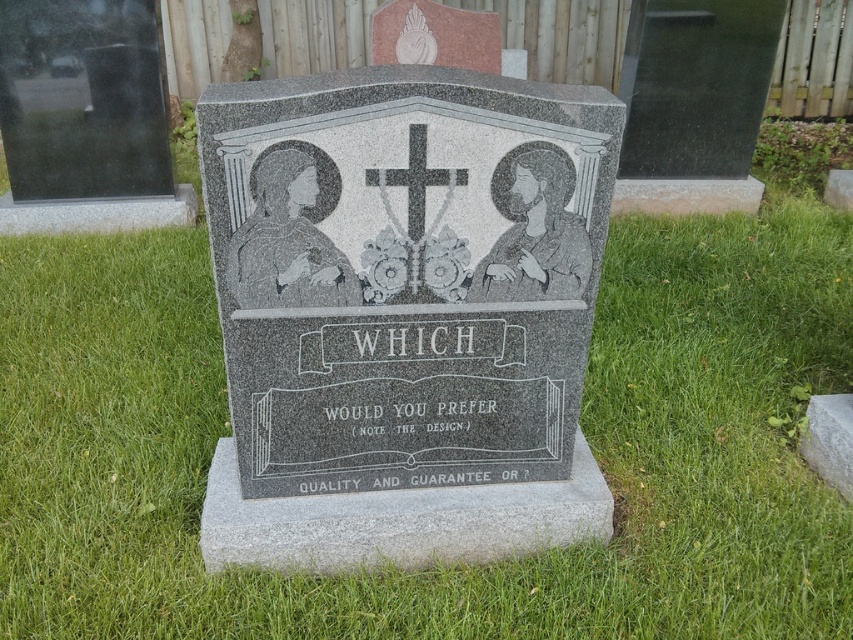
Question: Among these points, which one is farthest from the camera?

Choices:
 (A) (396, 182)
 (B) (541, 260)

Answer: (B)

Question: Is green grass at center behind granite monument at center?

Choices:
 (A) yes
 (B) no

Answer: (A)

Question: Which of these objects is positioned farthest from the green grass at center?

Choices:
 (A) granite gravestone at lower right
 (B) black granite cross at center
 (C) granite monument at center

Answer: (B)

Question: Does granite monument at center appear on the left side of granite gravestone at lower right?

Choices:
 (A) yes
 (B) no

Answer: (A)

Question: Which point is farther to the camera?

Choices:
 (A) (418, 124)
 (B) (408, 508)
 (C) (123, 305)

Answer: (C)

Question: Does green grass at center have a greater width compared to granite gravestone at lower right?

Choices:
 (A) no
 (B) yes

Answer: (B)